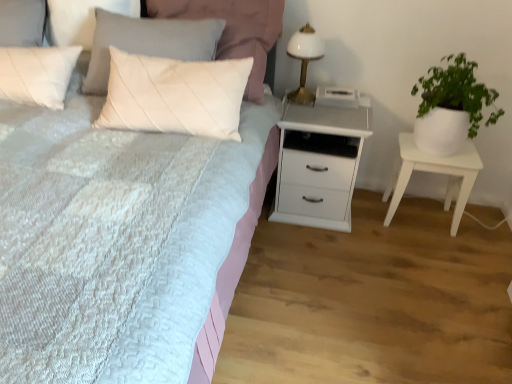
The image size is (512, 384). What are the coordinates of `vacant space to the right of white wood chest of drawers at center` in the screenshot? It's located at (381, 224).